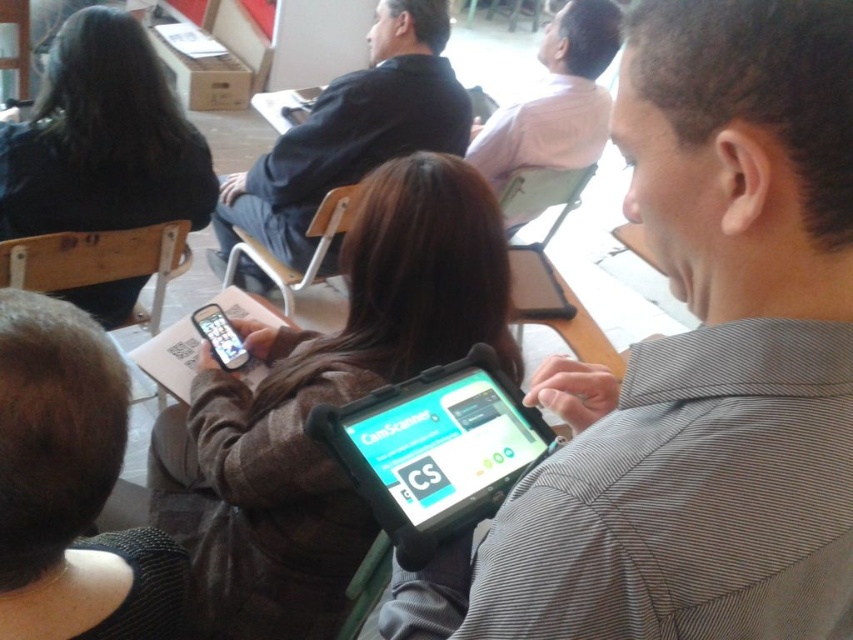
Question: Is gray striped shirt at center smaller than pink fabric shirt at upper center?

Choices:
 (A) yes
 (B) no

Answer: (A)

Question: Based on their relative distances, which object is farther from the matte black tablet at center?

Choices:
 (A) gray striped shirt at center
 (B) black matte suit at center

Answer: (B)

Question: Can you confirm if black rubberized tablet at center is positioned to the left of pink fabric shirt at upper center?

Choices:
 (A) yes
 (B) no

Answer: (A)

Question: Is gray striped shirt at center behind black fabric phone at upper left?

Choices:
 (A) no
 (B) yes

Answer: (A)

Question: Which object is closer to the camera taking this photo?

Choices:
 (A) black fabric phone at upper left
 (B) gray striped shirt at center

Answer: (B)

Question: Considering the real-world distances, which object is farthest from the black rubberized tablet at center?

Choices:
 (A) black fabric phone at upper left
 (B) black matte suit at center

Answer: (B)